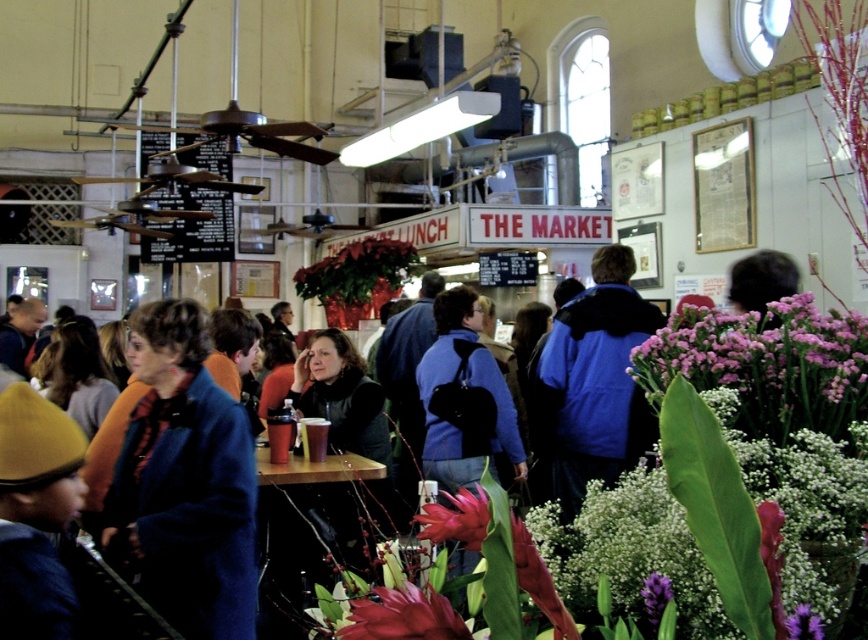
Between blue woolen coat at center and glossy red flower at center, which one is positioned lower?

blue woolen coat at center

Between blue woolen coat at center and glossy red flower at center, which one has less height?

glossy red flower at center is shorter.

Image resolution: width=868 pixels, height=640 pixels. What do you see at coordinates (183, 483) in the screenshot?
I see `blue woolen coat at center` at bounding box center [183, 483].

Where is `blue woolen coat at center`? blue woolen coat at center is located at coordinates (183, 483).

Does point (178, 570) come behind point (571, 476)?

That is False.

Who is more distant from viewer, (163, 344) or (557, 467)?

The point (557, 467) is more distant.

This screenshot has width=868, height=640. What do you see at coordinates (183, 483) in the screenshot?
I see `blue woolen coat at center` at bounding box center [183, 483].

Identify the location of blue woolen coat at center. (183, 483).

Which is more to the right, purple matte flowers at right or blue fleece jacket at center?

From the viewer's perspective, blue fleece jacket at center appears more on the right side.

Who is more forward, [866,332] or [602,317]?

Positioned in front is point [866,332].

Identify the location of purple matte flowers at right. (764, 360).